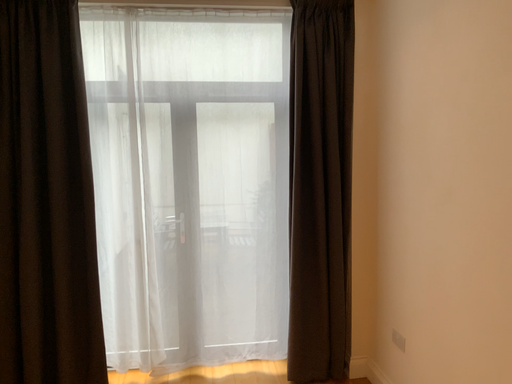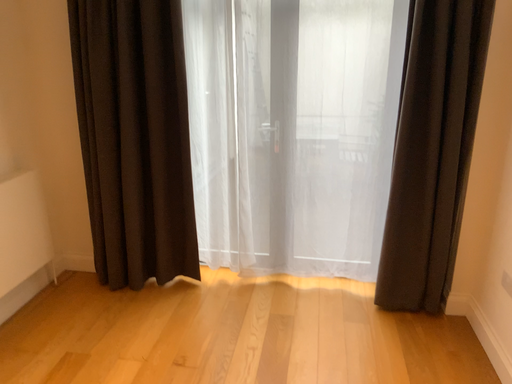
Question: How did the camera likely rotate when shooting the video?

Choices:
 (A) rotated downward
 (B) rotated upward

Answer: (A)